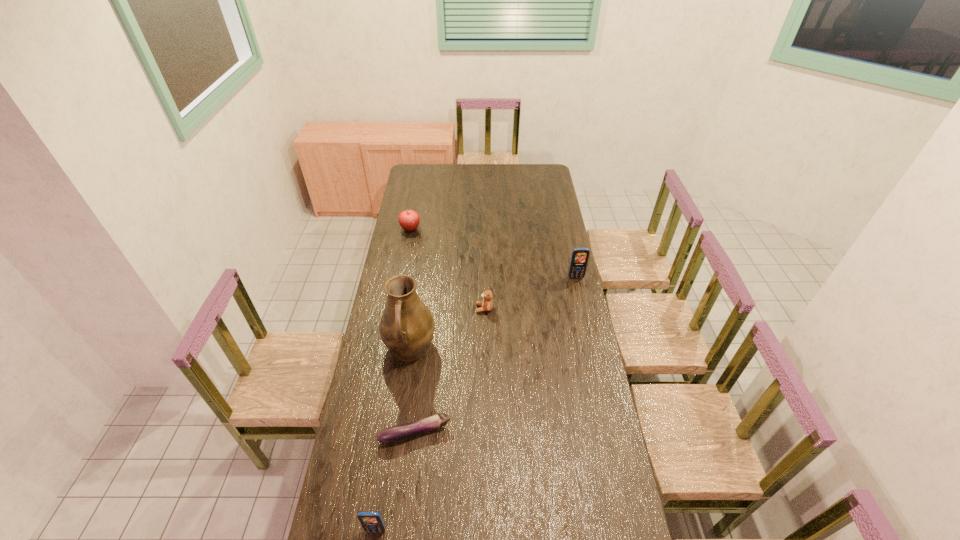
Identify which object is located as the fourth nearest to the eggplant. Please provide its 2D coordinates. Your answer should be formatted as a tuple, i.e. [(x, y)], where the tuple contains the x and y coordinates of a point satisfying the conditions above.

[(580, 256)]

Identify the location of free space that satisfies the following two spatial constraints: 1. on the handle side of the pitcher; 2. on the right side of the fifth farthest object. This screenshot has width=960, height=540. (398, 433).